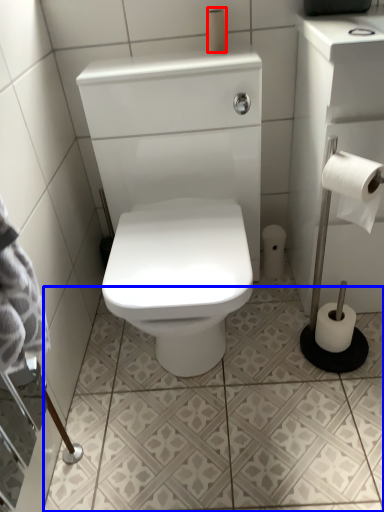
Question: Among these objects, which one is nearest to the camera, toilet paper (highlighted by a red box) or ceramic tile (highlighted by a blue box)?

Choices:
 (A) toilet paper
 (B) ceramic tile

Answer: (B)